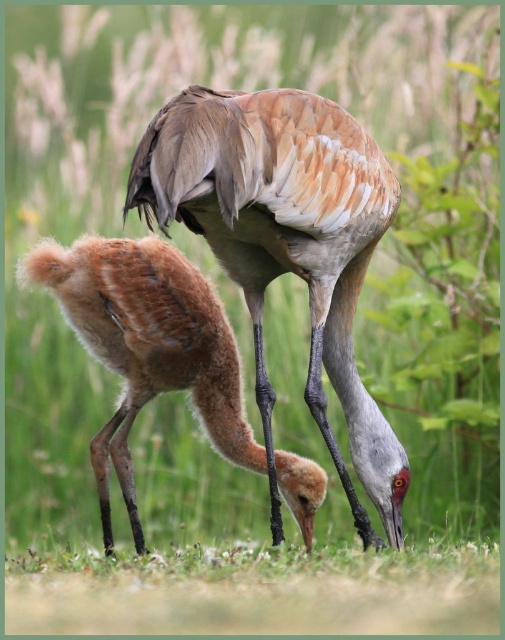
You are a birdwatcher observing the scene. You notice the brown feathered crane at center and the brown fluffy chick at lower left. Which one is positioned more to the right side of the image?

The brown feathered crane at center is positioned more to the right side of the image compared to the brown fluffy chick at lower left.

You are a wildlife photographer aiming to capture a photo of the brown feathered crane at center and the brown fluffy chick at lower left. Based on their positions, which bird will appear larger in the photo?

The brown feathered crane at center will appear larger in the photo because it is much taller than the brown fluffy chick at lower left.